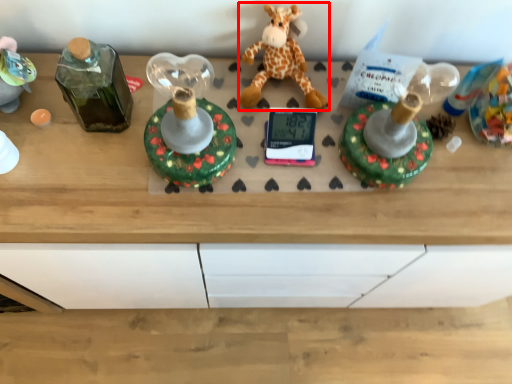
Question: From the image's perspective, where is giraffe (annotated by the red box) located in relation to toy in the image?

Choices:
 (A) below
 (B) above

Answer: (B)